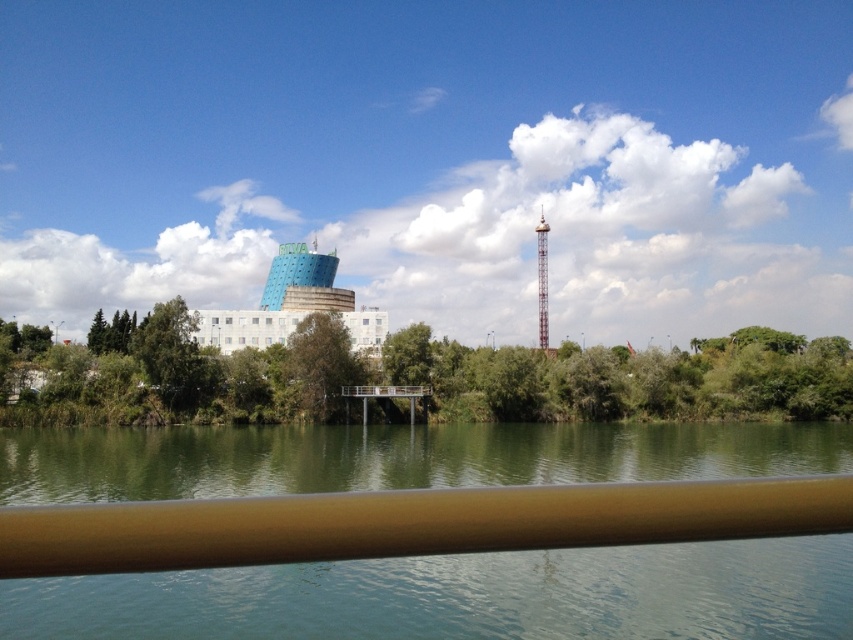
You are an architect evaluating the riverside area for a new project. You notice the green leafy tree at center and the blue glass building at center. Which structure is taller, and how does this affect potential visibility from the proposed building?

The blue glass building at center is taller than the green leafy tree at center. This means the proposed building could potentially have unobstructed views over the tree, but must consider the tree as part of the landscape balance.

You are standing on the bridge and want to take a photo of the green smooth water at center. Where should you position your camera to capture it best?

The green smooth water at center is located at point (465, 596), so position your camera at that coordinate to capture it best.